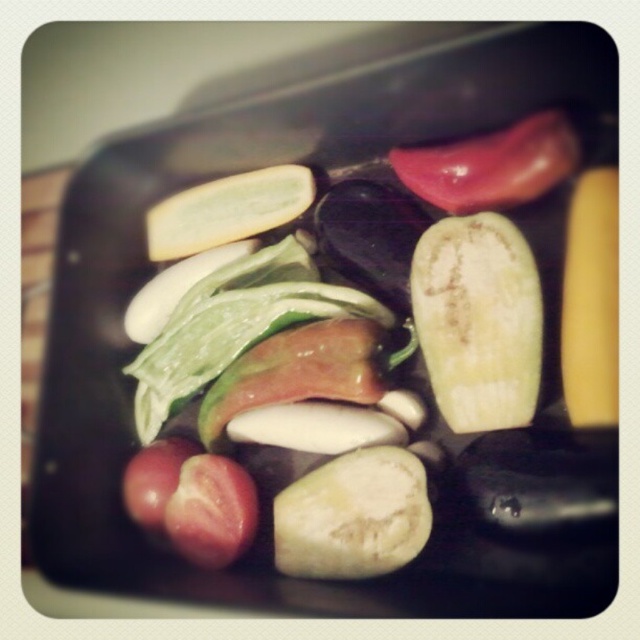
From the picture: Can you confirm if green matte eggplant at center is thinner than shiny red tomato at upper center?

Yes, green matte eggplant at center is thinner than shiny red tomato at upper center.

Does green matte eggplant at center lie in front of shiny red tomato at upper center?

Yes.

Where is `green matte eggplant at center`? The image size is (640, 640). green matte eggplant at center is located at coordinates (477, 321).

In order to click on green matte eggplant at center in this screenshot , I will do `click(477, 321)`.

Does red matte tomato at center appear under red matte tomato at lower left?

Yes, red matte tomato at center is below red matte tomato at lower left.

Which is behind, point (230, 524) or point (157, 486)?

Positioned behind is point (157, 486).

Measure the distance between point (232, 556) and camera.

A distance of 1.09 meters exists between point (232, 556) and camera.

Find the location of `red matte tomato at center`. red matte tomato at center is located at coordinates (211, 509).

Measure the distance between green matte apple at center and camera.

green matte apple at center and camera are 3.29 feet apart.

Is green matte apple at center taller than red matte tomato at center?

Yes.

Which is behind, point (358, 554) or point (227, 557)?

Point (227, 557)

This screenshot has height=640, width=640. I want to click on green matte apple at center, so click(353, 515).